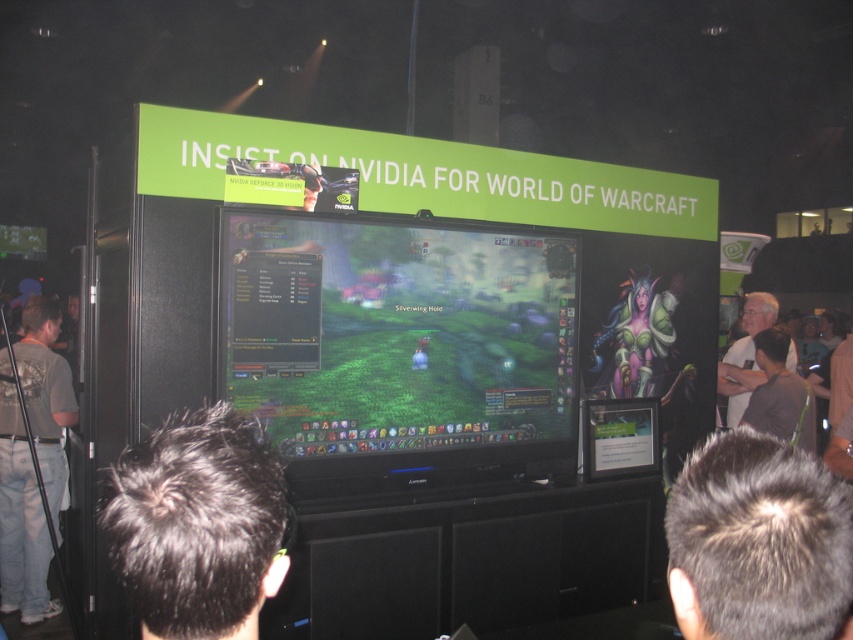
Is shiny black monitor at center positioned in front of white matte shirt at right?

Yes, shiny black monitor at center is closer to the viewer.

Which is below, shiny black monitor at center or white matte shirt at right?

white matte shirt at right

The width and height of the screenshot is (853, 640). What do you see at coordinates (395, 333) in the screenshot?
I see `shiny black monitor at center` at bounding box center [395, 333].

You are a GUI agent. You are given a task and a screenshot of the screen. Output one action in this format:
    pyautogui.click(x=<x>, y=<y>)
    Task: Click on the shiny black monitor at center
    The height and width of the screenshot is (640, 853).
    Given the screenshot: What is the action you would take?
    tap(395, 333)

Can you confirm if dark hair at center is taller than white matte shirt at right?

No, dark hair at center is not taller than white matte shirt at right.

Is point (251, 486) closer to camera compared to point (770, 305)?

Yes, it is in front of point (770, 305).

Is point (170, 605) closer to viewer compared to point (730, 401)?

Yes, point (170, 605) is in front of point (730, 401).

Where is `dark hair at center`? dark hair at center is located at coordinates (199, 524).

The image size is (853, 640). I want to click on shiny black monitor at center, so click(x=395, y=333).

Can you confirm if shiny black monitor at center is wider than gray t-shirt at left?

Yes.

What do you see at coordinates (395, 333) in the screenshot? This screenshot has height=640, width=853. I see `shiny black monitor at center` at bounding box center [395, 333].

You are a GUI agent. You are given a task and a screenshot of the screen. Output one action in this format:
    pyautogui.click(x=<x>, y=<y>)
    Task: Click on the shiny black monitor at center
    The height and width of the screenshot is (640, 853).
    Given the screenshot: What is the action you would take?
    pyautogui.click(x=395, y=333)